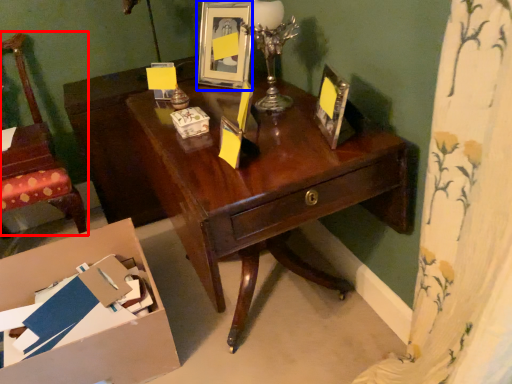
Question: Which object appears closest to the camera in this image, chair (highlighted by a red box) or picture frame (highlighted by a blue box)?

Choices:
 (A) chair
 (B) picture frame

Answer: (A)